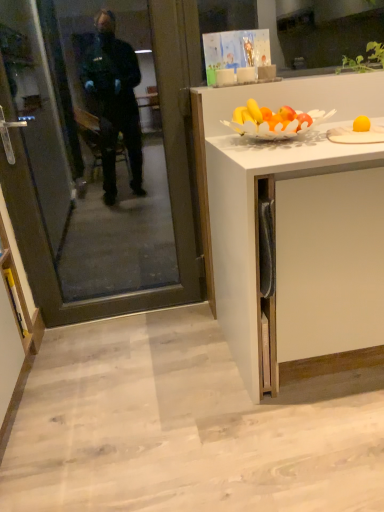
Identify the location of free space to the left of white matte cabinet at right, arranged as the first cabinetry when viewed from the right. (166, 386).